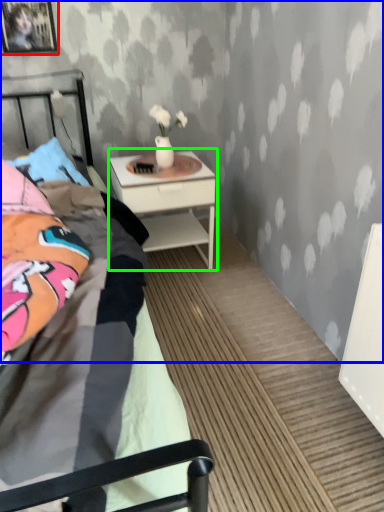
Question: Which is farther away from picture frame (highlighted by a red box)? backdrop (highlighted by a blue box) or nightstand (highlighted by a green box)?

Choices:
 (A) backdrop
 (B) nightstand

Answer: (B)